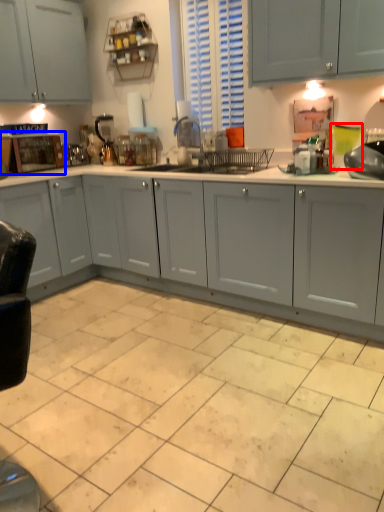
Question: Which object appears closest to the camera in this image, teal (highlighted by a red box) or home appliance (highlighted by a blue box)?

Choices:
 (A) teal
 (B) home appliance

Answer: (A)